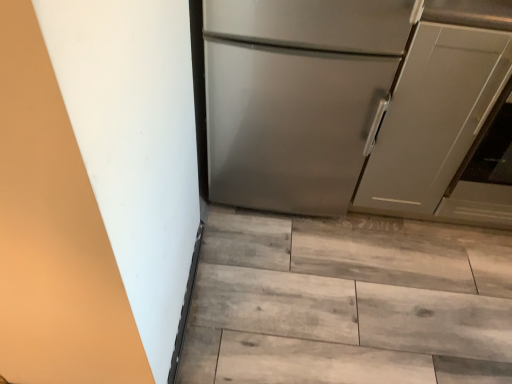
Locate an element on the screen. The image size is (512, 384). matte gray cabinet at right is located at coordinates (x=434, y=116).

The width and height of the screenshot is (512, 384). I want to click on satin silver refrigerator at center, so click(x=359, y=106).

Consider the image. Is wooden floor at lower center touching matte gray cabinet at right?

No, wooden floor at lower center is not next to matte gray cabinet at right.

Which of these two, wooden floor at lower center or matte gray cabinet at right, stands shorter?

wooden floor at lower center.

From a real-world perspective, is wooden floor at lower center positioned over matte gray cabinet at right based on gravity?

Incorrect, from a real-world perspective, wooden floor at lower center is lower than matte gray cabinet at right.

Is matte gray cabinet at right next to satin silver refrigerator at center?

There is a gap between matte gray cabinet at right and satin silver refrigerator at center.

From a real-world perspective, is matte gray cabinet at right beneath satin silver refrigerator at center?

Indeed, from a real-world perspective, matte gray cabinet at right is positioned beneath satin silver refrigerator at center.

From the image's perspective, is matte gray cabinet at right over satin silver refrigerator at center?

No, from the image's perspective, matte gray cabinet at right is not above satin silver refrigerator at center.

Is matte gray cabinet at right taller or shorter than satin silver refrigerator at center?

Clearly, matte gray cabinet at right is shorter compared to satin silver refrigerator at center.

Based on their sizes in the image, would you say wooden floor at lower center is bigger or smaller than satin silver refrigerator at center?

Considering their sizes, wooden floor at lower center takes up less space than satin silver refrigerator at center.

This screenshot has width=512, height=384. Identify the location of refrigerator on the left of wooden floor at lower center. pos(359,106).

From the image's perspective, which one is positioned higher, wooden floor at lower center or satin silver refrigerator at center?

satin silver refrigerator at center.

Considering the points (406, 275) and (323, 144), which point is in front, point (406, 275) or point (323, 144)?

The point (323, 144) is closer to the camera.

Is matte gray cabinet at right at the back of satin silver refrigerator at center?

satin silver refrigerator at center is not turned away from matte gray cabinet at right.

The image size is (512, 384). Identify the location of door below the satin silver refrigerator at center (from the image's perspective). (434, 116).

Considering the sizes of objects satin silver refrigerator at center and matte gray cabinet at right in the image provided, who is wider, satin silver refrigerator at center or matte gray cabinet at right?

matte gray cabinet at right is wider.

How far apart are satin silver refrigerator at center and wooden floor at lower center?

satin silver refrigerator at center and wooden floor at lower center are 17.63 inches apart.

Are satin silver refrigerator at center and wooden floor at lower center making contact?

satin silver refrigerator at center and wooden floor at lower center are not in contact.

From the picture: From the image's perspective, is satin silver refrigerator at center above or below wooden floor at lower center?

Based on their image positions, satin silver refrigerator at center is located above wooden floor at lower center.

Considering the relative sizes of satin silver refrigerator at center and wooden floor at lower center in the image provided, is satin silver refrigerator at center bigger than wooden floor at lower center?

Indeed, satin silver refrigerator at center has a larger size compared to wooden floor at lower center.

From the image's perspective, which is above, matte gray cabinet at right or wooden floor at lower center?

matte gray cabinet at right appears higher in the image.

Consider the image. Are matte gray cabinet at right and wooden floor at lower center far apart?

They are positioned close to each other.

Is matte gray cabinet at right outside of wooden floor at lower center?

matte gray cabinet at right lies outside wooden floor at lower center's area.

Identify the location of stairwell below the matte gray cabinet at right (from the image's perspective). (348, 302).

Image resolution: width=512 pixels, height=384 pixels. In order to click on stairwell below the matte gray cabinet at right (from the image's perspective) in this screenshot , I will do `click(348, 302)`.

The image size is (512, 384). I want to click on refrigerator above the matte gray cabinet at right (from the image's perspective), so (359, 106).

Looking at the image, which one is located further to satin silver refrigerator at center, matte gray cabinet at right or wooden floor at lower center?

Among the two, wooden floor at lower center is located further to satin silver refrigerator at center.

Looking at this image, which object lies nearer to the anchor point matte gray cabinet at right, satin silver refrigerator at center or wooden floor at lower center?

satin silver refrigerator at center lies closer to matte gray cabinet at right than the other object.

Looking at the image, which one is located closer to wooden floor at lower center, satin silver refrigerator at center or matte gray cabinet at right?

satin silver refrigerator at center is closer to wooden floor at lower center.

Estimate the real-world distances between objects in this image. Which object is further from wooden floor at lower center, matte gray cabinet at right or satin silver refrigerator at center?

matte gray cabinet at right is positioned further to the anchor wooden floor at lower center.

Which object lies nearer to the anchor point matte gray cabinet at right, wooden floor at lower center or satin silver refrigerator at center?

satin silver refrigerator at center is positioned closer to the anchor matte gray cabinet at right.

In the scene shown: Estimate the real-world distances between objects in this image. Which object is further from satin silver refrigerator at center, wooden floor at lower center or matte gray cabinet at right?

Among the two, wooden floor at lower center is located further to satin silver refrigerator at center.

You are a GUI agent. You are given a task and a screenshot of the screen. Output one action in this format:
    pyautogui.click(x=<x>, y=<y>)
    Task: Click on the door that lies between satin silver refrigerator at center and wooden floor at lower center from top to bottom
    
    Given the screenshot: What is the action you would take?
    pyautogui.click(x=434, y=116)